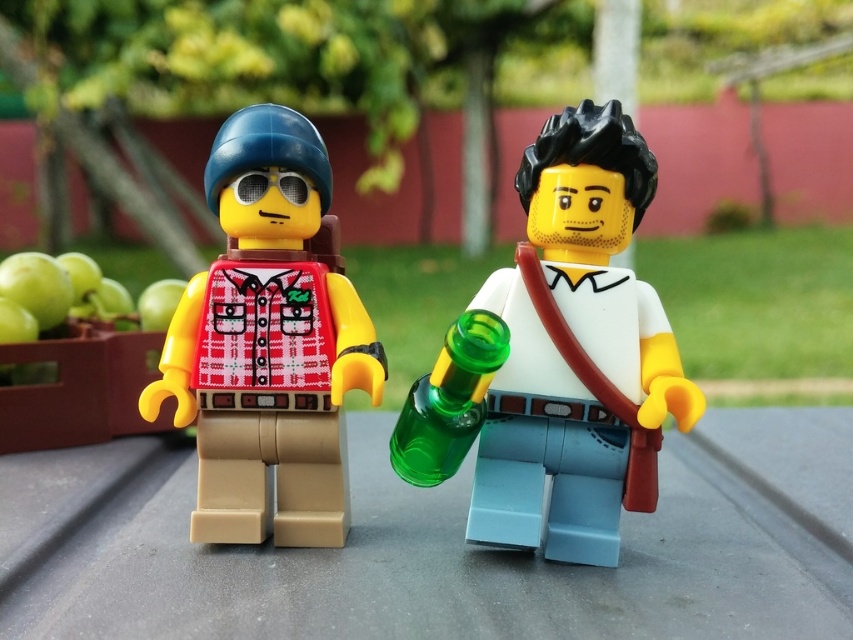
Based on the photo, can you confirm if smooth white shirt at center is thinner than matte red plaid shirt at center?

In fact, smooth white shirt at center might be wider than matte red plaid shirt at center.

Does smooth white shirt at center have a lesser height compared to matte red plaid shirt at center?

No.

I want to click on smooth white shirt at center, so click(560, 356).

Where is `smooth white shirt at center`? This screenshot has height=640, width=853. smooth white shirt at center is located at coordinates (560, 356).